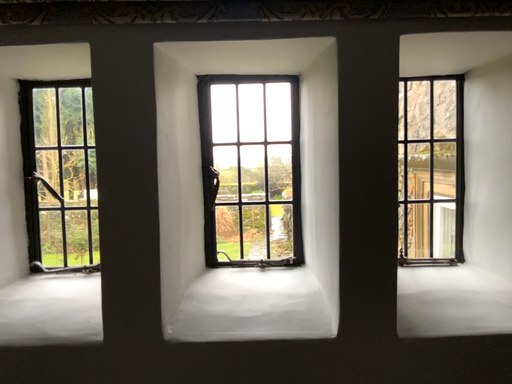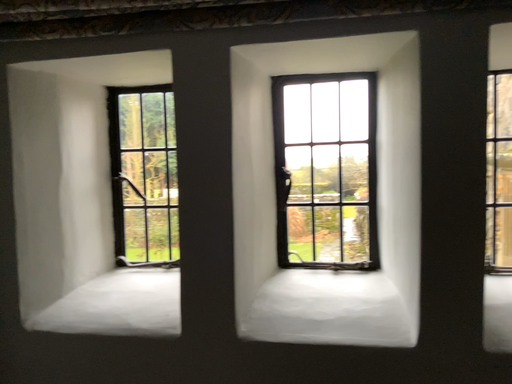
Question: How did the camera likely rotate when shooting the video?

Choices:
 (A) rotated left
 (B) rotated right

Answer: (A)